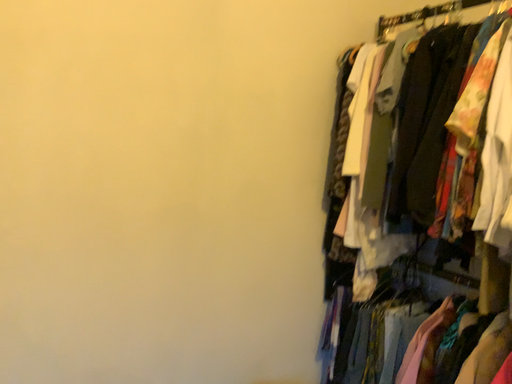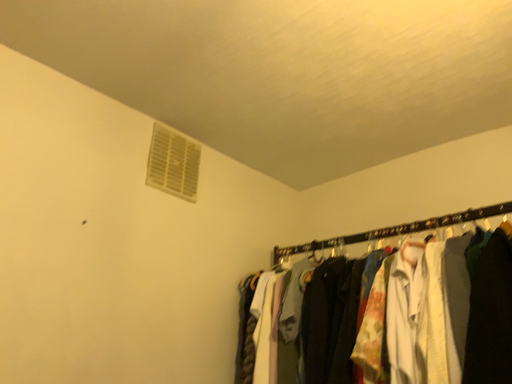
Question: Which way did the camera rotate in the video?

Choices:
 (A) rotated downward
 (B) rotated upward

Answer: (B)